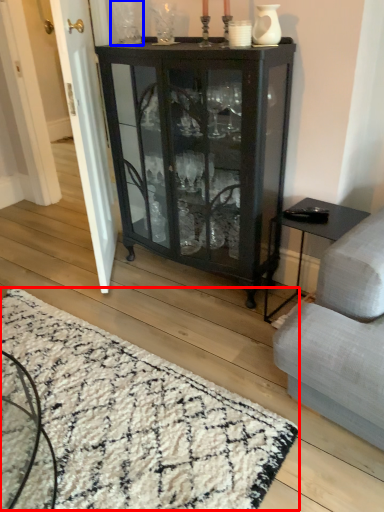
Question: Among these objects, which one is farthest to the camera, mat (highlighted by a red box) or glass vase (highlighted by a blue box)?

Choices:
 (A) mat
 (B) glass vase

Answer: (B)